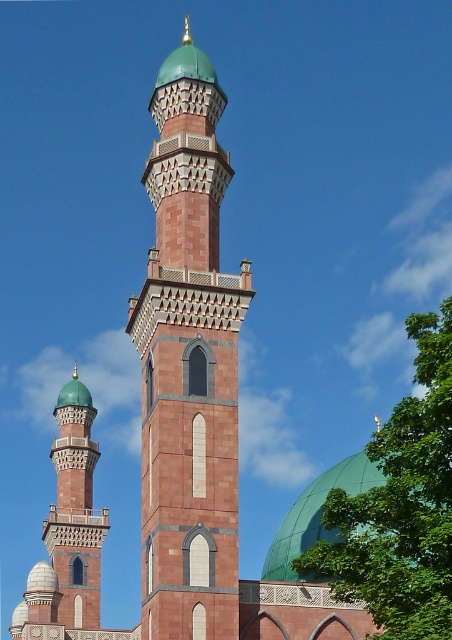
You are standing at the entrance of the mosque and see two points marked in the image. The first point is at coordinate point (x=219, y=548) and the second is at point (x=306, y=502). Which point is closer to you?

Point (x=219, y=548) is in front of point (x=306, y=502), so it is closer to you.